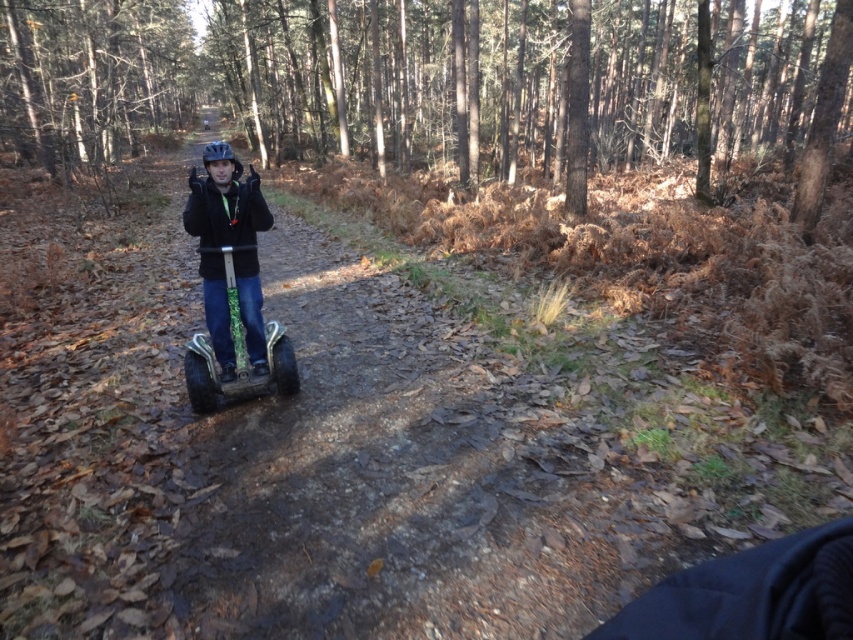
Question: Estimate the real-world distances between objects in this image. Which object is farther from the matte black helmet at center?

Choices:
 (A) brown matte forest at center
 (B) green textured segway at center

Answer: (A)

Question: Can you confirm if brown matte forest at center is wider than green textured segway at center?

Choices:
 (A) no
 (B) yes

Answer: (B)

Question: Is brown matte forest at center positioned in front of green textured segway at center?

Choices:
 (A) no
 (B) yes

Answer: (A)

Question: Which of the following is the closest to the observer?

Choices:
 (A) matte black helmet at center
 (B) green textured segway at center
 (C) brown matte forest at center

Answer: (A)

Question: Does brown matte forest at center have a larger size compared to green textured segway at center?

Choices:
 (A) no
 (B) yes

Answer: (B)

Question: Which object appears farthest from the camera in this image?

Choices:
 (A) brown matte forest at center
 (B) matte black helmet at center

Answer: (A)